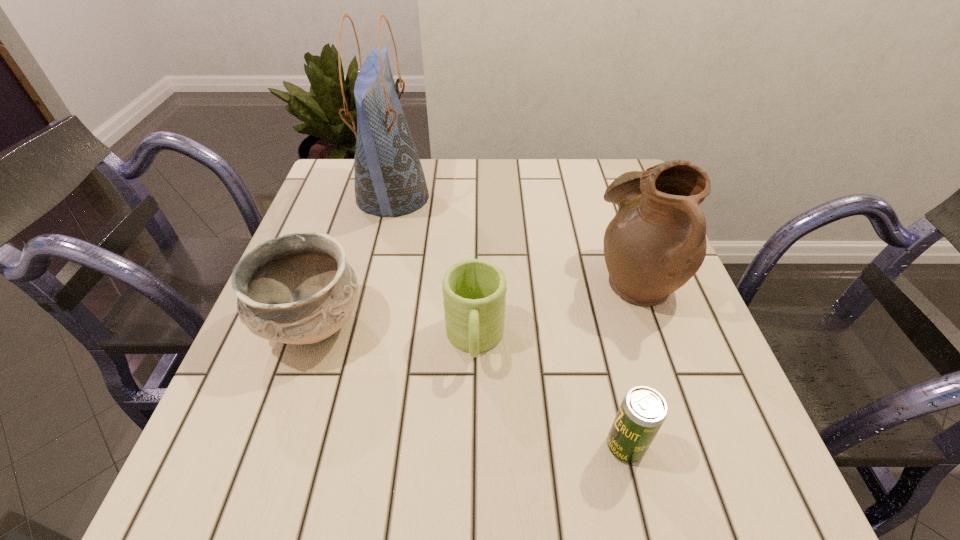
At what (x,y) coordinates should I click in order to perform the action: click on free space at the near edge of the desktop. Please return your answer as a coordinate pair (x, y). Looking at the image, I should click on (593, 466).

Image resolution: width=960 pixels, height=540 pixels. Find the location of `free space at the left edge of the desktop`. free space at the left edge of the desktop is located at coordinates (311, 227).

Where is `vacant space at the far left corner`? The height and width of the screenshot is (540, 960). vacant space at the far left corner is located at coordinates (334, 185).

What are the coordinates of `vacant space that is in between the pottery and the beer can` in the screenshot? It's located at (469, 386).

Locate an element on the screen. free space between the mug and the nearest object is located at coordinates (550, 394).

Identify the location of empty location between the mug and the pottery. (394, 333).

The height and width of the screenshot is (540, 960). I want to click on vacant region between the nearest object and the pottery, so click(469, 386).

Where is `empty location between the pitcher and the third object from left to right`? The width and height of the screenshot is (960, 540). empty location between the pitcher and the third object from left to right is located at coordinates (556, 310).

Where is `free space between the beer can and the pitcher`? This screenshot has height=540, width=960. free space between the beer can and the pitcher is located at coordinates (631, 363).

At what (x,y) coordinates should I click in order to perform the action: click on free space between the mug and the nearest object. Please return your answer as a coordinate pair (x, y). Image resolution: width=960 pixels, height=540 pixels. Looking at the image, I should click on (550, 394).